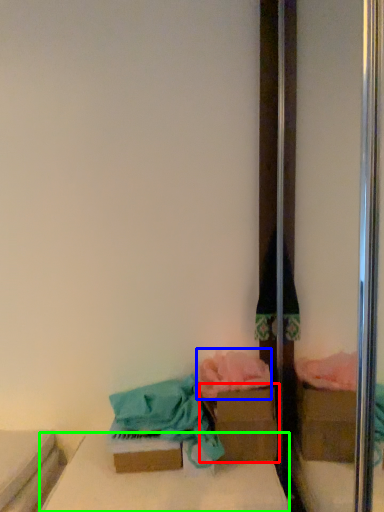
Question: Based on their relative distances, which object is nearer to cardboard box (highlighted by a red box)? Choose from material (highlighted by a blue box) and furniture (highlighted by a green box).

Choices:
 (A) material
 (B) furniture

Answer: (A)